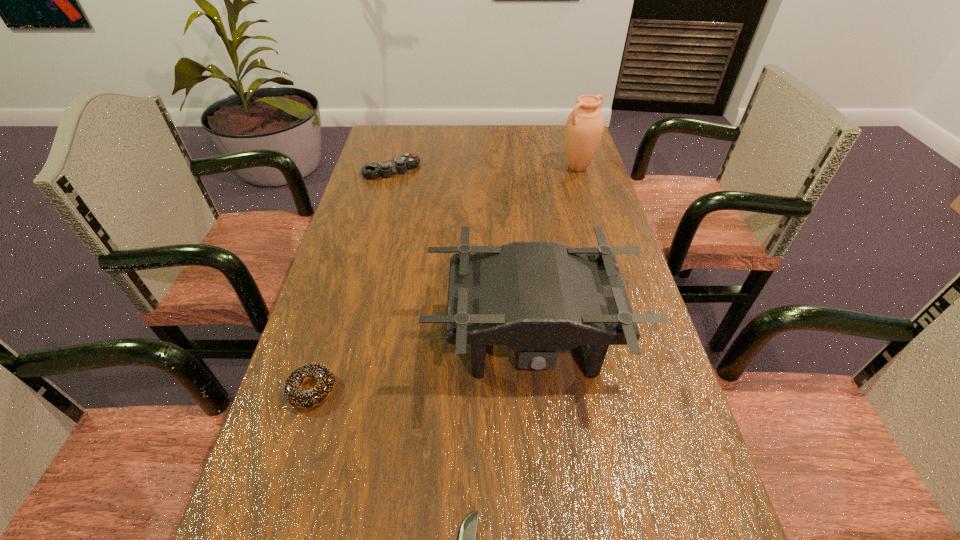
Find the location of `doughnut that is at the left edge`. doughnut that is at the left edge is located at coordinates (293, 393).

In order to click on urn that is at the right edge in this screenshot , I will do `click(584, 127)`.

Where is `drone at the right edge`? drone at the right edge is located at coordinates (537, 297).

Locate an element on the screen. object present at the far right corner is located at coordinates (584, 127).

Identify the location of vacant point at the far edge. (468, 129).

Identify the location of vacant space at the left edge of the desktop. The image size is (960, 540). (340, 397).

Image resolution: width=960 pixels, height=540 pixels. I want to click on vacant space at the right edge of the desktop, so click(x=569, y=186).

In the image, there is a desktop. Where is `vacant space at the far left corner`? This screenshot has height=540, width=960. vacant space at the far left corner is located at coordinates [389, 156].

This screenshot has height=540, width=960. Identify the location of free space between the third shortest object and the second shortest object. (351, 280).

Where is `empty location between the drone and the doughnut`? empty location between the drone and the doughnut is located at coordinates (421, 365).